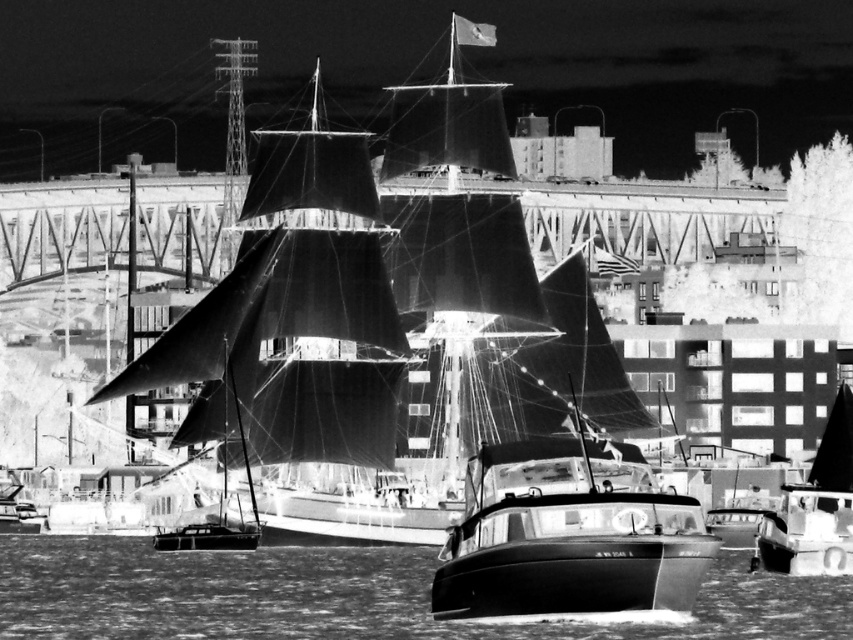
Question: Which object is farther from the camera taking this photo?

Choices:
 (A) smooth black sailboat at center
 (B) translucent water at lower center

Answer: (A)

Question: Does translucent water at lower center have a smaller size compared to smooth black sailboat at center?

Choices:
 (A) yes
 (B) no

Answer: (B)

Question: Can you confirm if translucent water at lower center is wider than smooth black sailboat at center?

Choices:
 (A) yes
 (B) no

Answer: (A)

Question: Can you confirm if translucent water at lower center is positioned below smooth black sailboat at center?

Choices:
 (A) no
 (B) yes

Answer: (B)